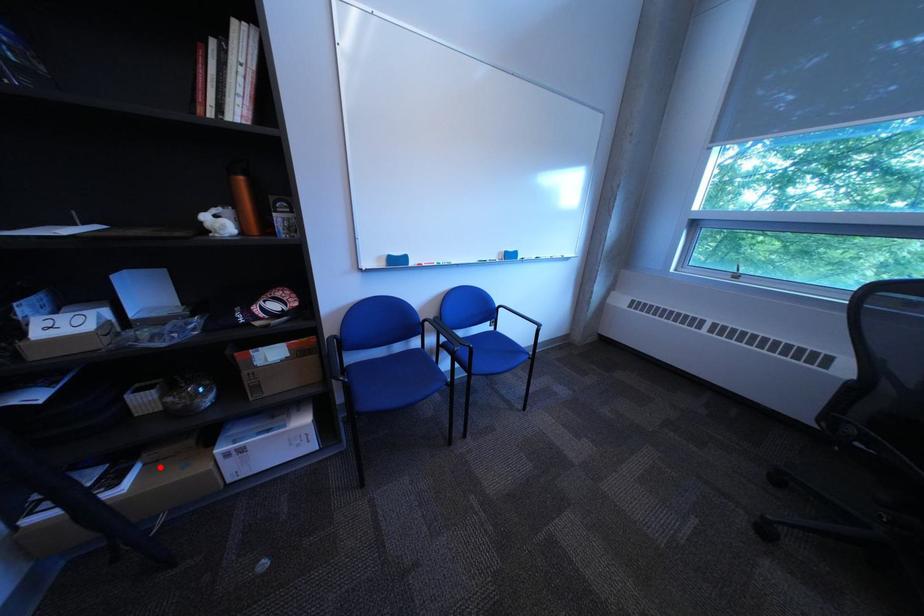
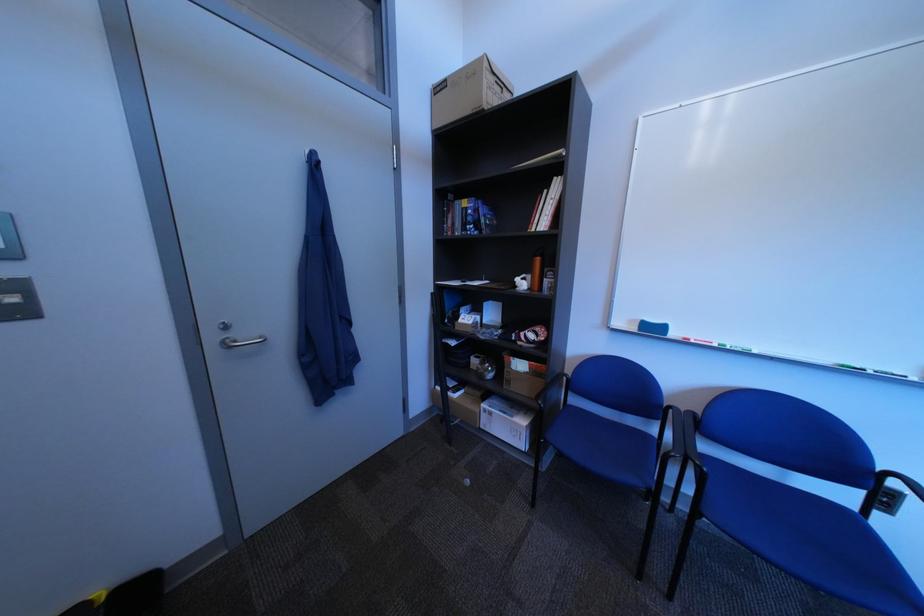
Question: I am providing you with two images of the same scene from different viewpoints. In image1, a red point is highlighted. Considering the same 3D point in image2, which of the following is correct?

Choices:
 (A) It is closer
 (B) It is farther

Answer: (B)